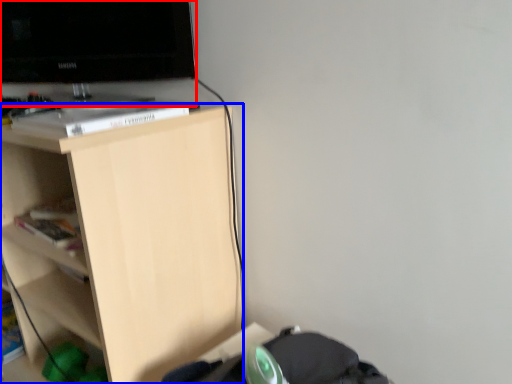
Question: Among these objects, which one is farthest to the camera, television (highlighted by a red box) or shelf (highlighted by a blue box)?

Choices:
 (A) television
 (B) shelf

Answer: (A)